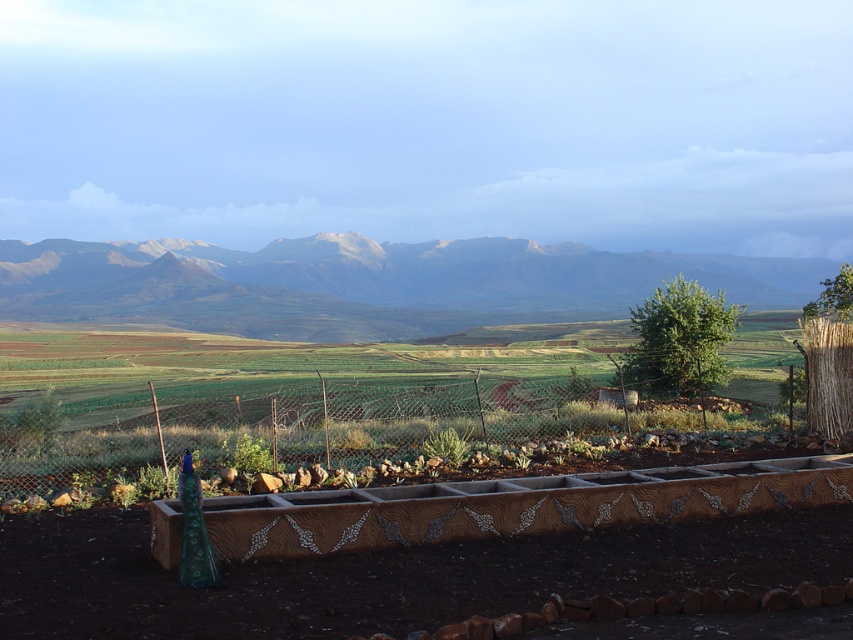
Question: Observing the image, what is the correct spatial positioning of metallic wire fence at lower center in reference to gray rocky mountains at upper center?

Choices:
 (A) left
 (B) right

Answer: (A)

Question: Based on their relative distances, which object is nearer to the metallic wire fence at lower center?

Choices:
 (A) green succulent at center
 (B) gray rocky mountains at upper center

Answer: (A)

Question: Can you confirm if gray rocky mountains at upper center is smaller than green succulent at center?

Choices:
 (A) yes
 (B) no

Answer: (B)

Question: Which of the following is the farthest from the observer?

Choices:
 (A) (59, 243)
 (B) (326, 436)
 (C) (442, 436)

Answer: (A)

Question: Which object is the closest to the metallic wire fence at lower center?

Choices:
 (A) green succulent at center
 (B) gray rocky mountains at upper center

Answer: (A)

Question: Can you confirm if metallic wire fence at lower center is positioned to the left of green succulent at center?

Choices:
 (A) no
 (B) yes

Answer: (B)